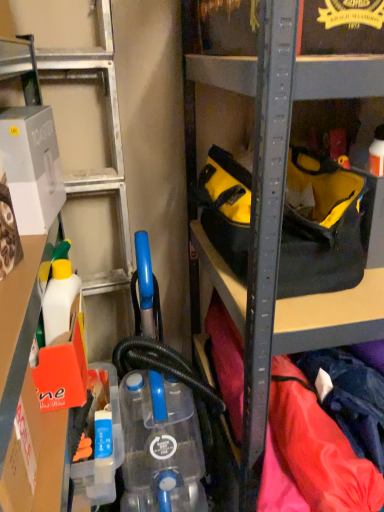
Question: Is white cardboard toaster at left surrounding blue translucent bottle at lower center?

Choices:
 (A) no
 (B) yes

Answer: (A)

Question: From a real-world perspective, is white cardboard toaster at left beneath blue translucent bottle at lower center?

Choices:
 (A) no
 (B) yes

Answer: (A)

Question: Is white cardboard toaster at left taller than blue translucent bottle at lower center?

Choices:
 (A) no
 (B) yes

Answer: (B)

Question: Is white cardboard toaster at left with blue translucent bottle at lower center?

Choices:
 (A) no
 (B) yes

Answer: (A)

Question: Considering the relative positions of white cardboard toaster at left and blue translucent bottle at lower center in the image provided, is white cardboard toaster at left to the left of blue translucent bottle at lower center from the viewer's perspective?

Choices:
 (A) yes
 (B) no

Answer: (A)

Question: From the image's perspective, is yellow fabric tool bag at center located above or below blue translucent bottle at lower center?

Choices:
 (A) below
 (B) above

Answer: (B)

Question: Is yellow fabric tool bag at center wider or thinner than blue translucent bottle at lower center?

Choices:
 (A) wide
 (B) thin

Answer: (A)

Question: Would you say yellow fabric tool bag at center is inside or outside blue translucent bottle at lower center?

Choices:
 (A) inside
 (B) outside

Answer: (B)

Question: Considering the positions of point (221, 159) and point (114, 461), is point (221, 159) closer or farther from the camera than point (114, 461)?

Choices:
 (A) farther
 (B) closer

Answer: (A)

Question: From the image's perspective, relative to white plastic container at left, is yellow fabric tool bag at center above or below?

Choices:
 (A) above
 (B) below

Answer: (A)

Question: Considering their positions, is yellow fabric tool bag at center located in front of or behind white plastic container at left?

Choices:
 (A) behind
 (B) front

Answer: (A)

Question: Do you think yellow fabric tool bag at center is within white plastic container at left, or outside of it?

Choices:
 (A) inside
 (B) outside

Answer: (B)

Question: Is point (352, 200) closer or farther from the camera than point (102, 282)?

Choices:
 (A) closer
 (B) farther

Answer: (A)

Question: Considering the positions of blue translucent bottle at lower center and white plastic container at left in the image, is blue translucent bottle at lower center taller or shorter than white plastic container at left?

Choices:
 (A) short
 (B) tall

Answer: (A)

Question: Considering the positions of blue translucent bottle at lower center and white plastic container at left in the image, is blue translucent bottle at lower center wider or thinner than white plastic container at left?

Choices:
 (A) wide
 (B) thin

Answer: (B)